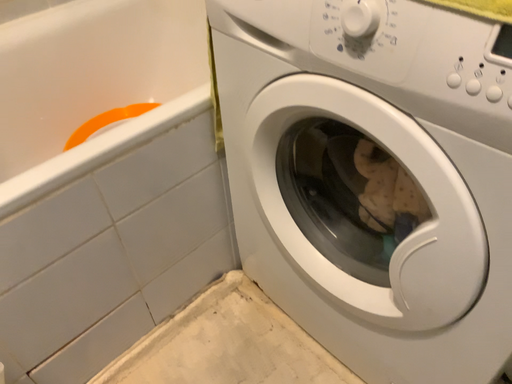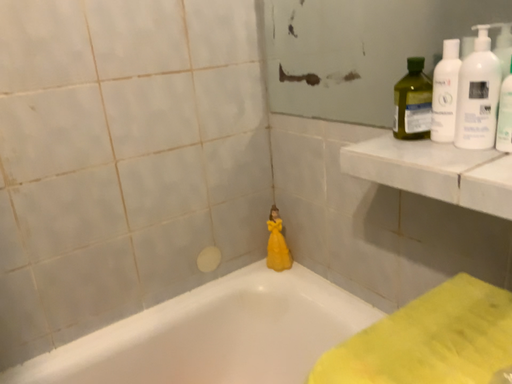
Question: How did the camera likely rotate when shooting the video?

Choices:
 (A) rotated left
 (B) rotated right

Answer: (A)